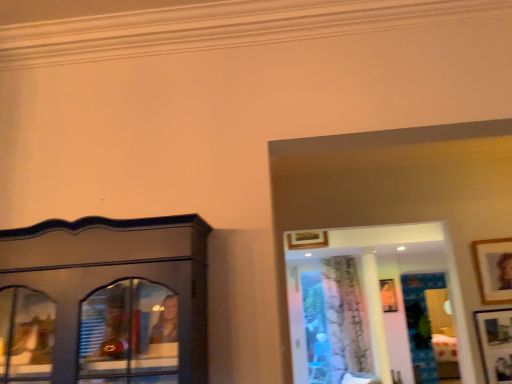
Question: Does white sheer curtain at center have a lesser width compared to wooden picture frame at lower right, which ranks as the third picture frame in top-to-bottom order?

Choices:
 (A) no
 (B) yes

Answer: (A)

Question: From the image's perspective, is white sheer curtain at center below wooden picture frame at lower right, the 3th picture frame viewed from the right?

Choices:
 (A) yes
 (B) no

Answer: (A)

Question: Does white sheer curtain at center lie in front of wooden picture frame at lower right, placed as the second picture frame when sorted from bottom to top?

Choices:
 (A) no
 (B) yes

Answer: (A)

Question: Is white sheer curtain at center positioned behind wooden picture frame at lower right, placed as the first picture frame when sorted from front to back?

Choices:
 (A) yes
 (B) no

Answer: (A)

Question: From a real-world perspective, is white sheer curtain at center on wooden picture frame at lower right, placed as the second picture frame when sorted from bottom to top?

Choices:
 (A) no
 (B) yes

Answer: (B)

Question: Would you say wooden picture frame at upper right, the 2th picture frame when ordered from right to left, is to the left or to the right of matte wooden picture frame at center, arranged as the fourth picture frame when viewed from the top, in the picture?

Choices:
 (A) left
 (B) right

Answer: (A)

Question: Is wooden picture frame at upper right, marked as the first picture frame in a top-to-bottom arrangement, taller or shorter than matte wooden picture frame at center, acting as the first picture frame starting from the bottom?

Choices:
 (A) short
 (B) tall

Answer: (B)

Question: In terms of width, does wooden picture frame at upper right, the 2th picture frame when ordered from right to left, look wider or thinner when compared to matte wooden picture frame at center, which is counted as the 4th picture frame, starting from the left?

Choices:
 (A) thin
 (B) wide

Answer: (A)

Question: Does point (505, 256) appear closer or farther from the camera than point (392, 306)?

Choices:
 (A) farther
 (B) closer

Answer: (B)

Question: From the image's perspective, is wooden picture frame at lower right, the 3th picture frame viewed from the right, positioned above or below white sheer curtain at center?

Choices:
 (A) above
 (B) below

Answer: (A)

Question: In terms of width, does wooden picture frame at lower right, arranged as the fourth picture frame when viewed from the back, look wider or thinner when compared to white sheer curtain at center?

Choices:
 (A) thin
 (B) wide

Answer: (A)

Question: In the image, is wooden picture frame at lower right, placed as the first picture frame when sorted from front to back, on the left side or the right side of white sheer curtain at center?

Choices:
 (A) right
 (B) left

Answer: (A)

Question: From a real-world perspective, is wooden picture frame at lower right, placed as the second picture frame when sorted from left to right, physically located above or below white sheer curtain at center?

Choices:
 (A) below
 (B) above

Answer: (A)

Question: Is wooden picture frame at upper center, the 3th picture frame in the front-to-back sequence, taller or shorter than white sheer curtain at center?

Choices:
 (A) short
 (B) tall

Answer: (A)

Question: Looking at the image, does wooden picture frame at upper center, which appears as the second picture frame when viewed from the top, seem bigger or smaller compared to white sheer curtain at center?

Choices:
 (A) big
 (B) small

Answer: (B)